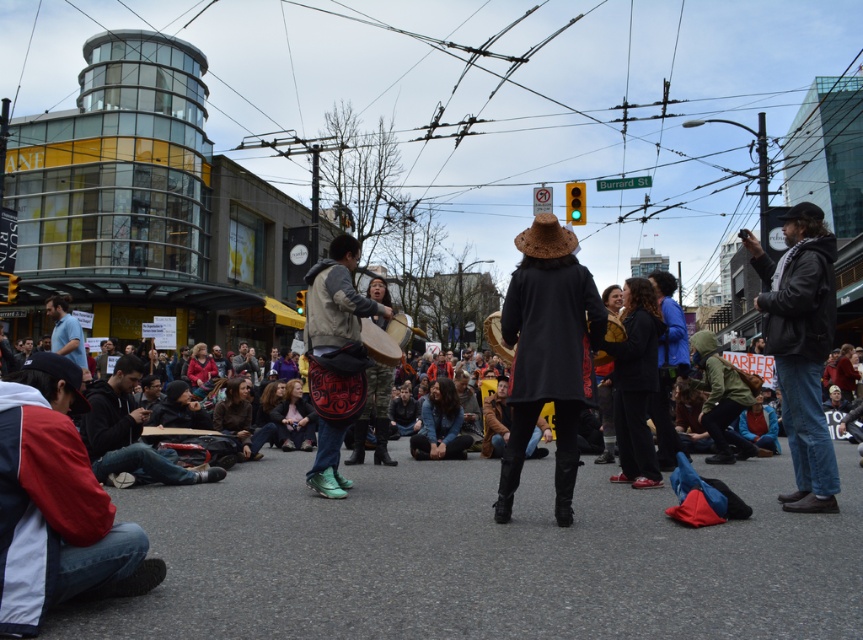
You are a photographer positioned at the edge of the street, aiming to capture a photo of both the denim jacket at right and the wooden drum at center. Which object will appear larger in your photo?

The denim jacket at right is closer to the viewer than the wooden drum at center, so it will appear larger in the photo.

You are a photographer standing on the sidewalk, trying to capture a photo of both the black matte coat at center and the denim jacket at right. Based on their positions, which object should you focus on first to ensure both are in the frame?

The black matte coat at center is to the left of the denim jacket at right, so you should focus on the black matte coat at center first to ensure both are in the frame.

You are a photographer at this event and want to capture a photo that includes both the denim jacket at right and the leather drum at center. To ensure both are in frame, should you adjust your camera to focus more to the right or the left?

The denim jacket at right is positioned on the right side of the leather drum at center, so to include both in the frame, you should adjust your camera to focus more to the right.